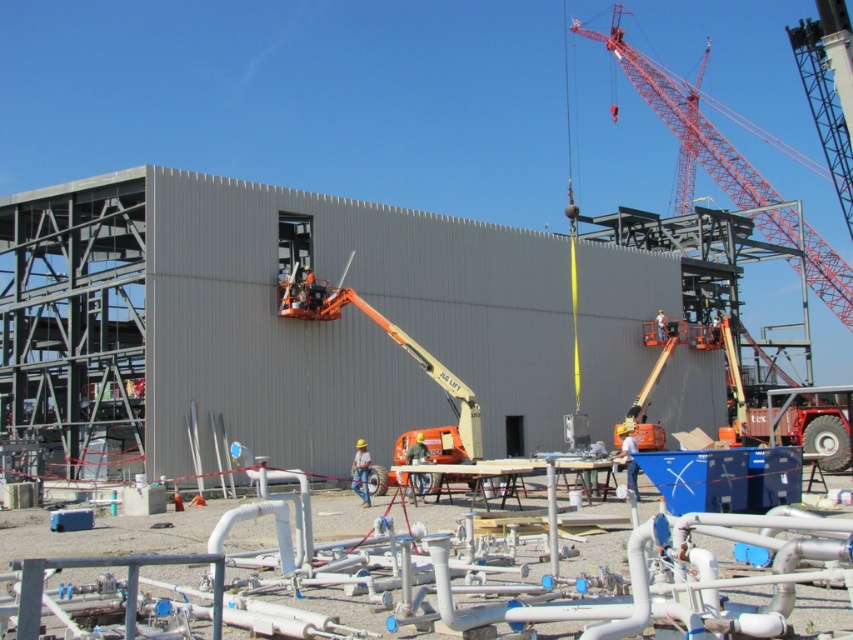
Is red metallic crane at upper right thinner than orange metallic lift at center?

Incorrect, red metallic crane at upper right's width is not less than orange metallic lift at center's.

Does red metallic crane at upper right appear over orange metallic lift at center?

Yes, red metallic crane at upper right is above orange metallic lift at center.

Locate an element on the screen. red metallic crane at upper right is located at coordinates (698, 134).